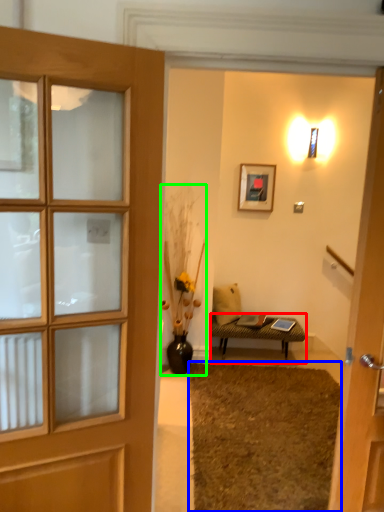
Question: Estimate the real-world distances between objects in this image. Which object is farther from table (highlighted by a red box), doormat (highlighted by a blue box) or houseplant (highlighted by a green box)?

Choices:
 (A) doormat
 (B) houseplant

Answer: (A)